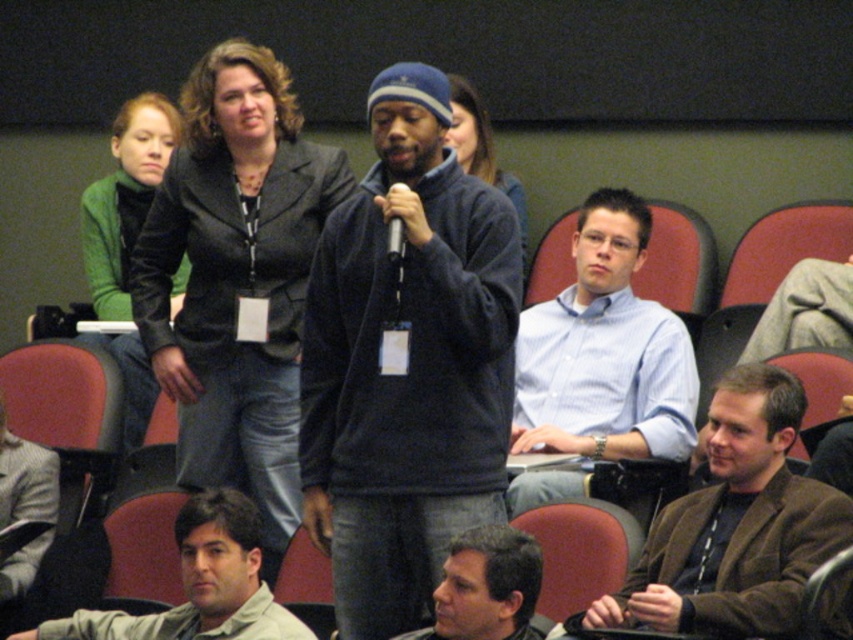
Is dark gray blazer at upper center bigger than matte black jacket at center?

Yes.

Which is in front, point (192, 385) or point (517, 224)?

Point (517, 224)

Identify the location of dark gray blazer at upper center. (236, 276).

Is dark blue fleece at center further to camera compared to gray wool sweater at lower left?

No, dark blue fleece at center is closer to the viewer.

Does point (511, 205) come closer to viewer compared to point (16, 593)?

Yes, it is in front of point (16, 593).

The width and height of the screenshot is (853, 640). Find the location of `dark blue fleece at center`. dark blue fleece at center is located at coordinates (405, 362).

Is point (175, 140) less distant than point (518, 624)?

No, it is behind (518, 624).

In the scene shown: Is the position of green fuzzy sweater at upper left more distant than that of gray hair at lower center?

Yes, green fuzzy sweater at upper left is behind gray hair at lower center.

This screenshot has height=640, width=853. What do you see at coordinates (125, 198) in the screenshot? I see `green fuzzy sweater at upper left` at bounding box center [125, 198].

Find the location of `green fuzzy sweater at upper left`. green fuzzy sweater at upper left is located at coordinates (125, 198).